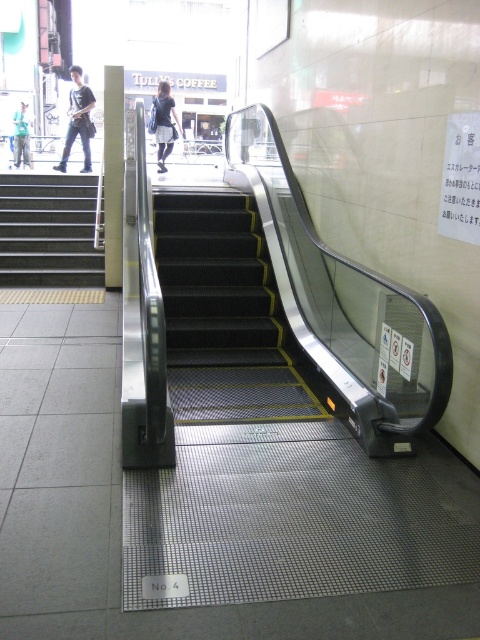
Question: Which object is the closest to the black carpeted stairs at center?

Choices:
 (A) matte black skirt at upper center
 (B) dark blue jeans at left
 (C) metallic gray stairs at left
 (D) green cotton shirt at left

Answer: (C)

Question: Which of the following is the closest to the observer?

Choices:
 (A) (82, 92)
 (B) (168, 90)
 (C) (72, 244)

Answer: (C)

Question: Is metallic gray stairs at left smaller than dark blue jeans at left?

Choices:
 (A) yes
 (B) no

Answer: (B)

Question: Is black carpeted stairs at center to the left of metallic gray stairs at left from the viewer's perspective?

Choices:
 (A) yes
 (B) no

Answer: (B)

Question: Is the position of matte black skirt at upper center less distant than that of green cotton shirt at left?

Choices:
 (A) yes
 (B) no

Answer: (A)

Question: Based on their relative distances, which object is nearer to the dark blue jeans at left?

Choices:
 (A) black carpeted stairs at center
 (B) metallic gray stairs at left
 (C) matte black skirt at upper center

Answer: (C)